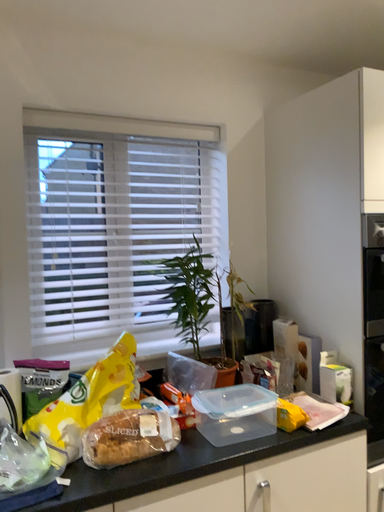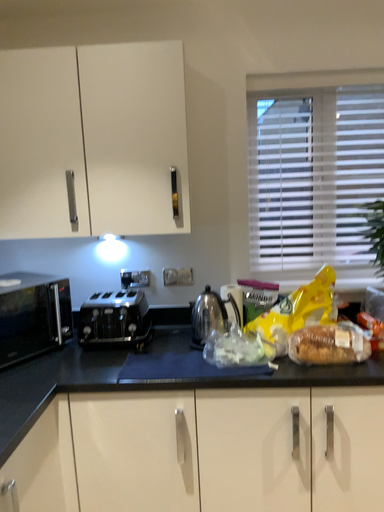
Question: How did the camera likely rotate when shooting the video?

Choices:
 (A) rotated upward
 (B) rotated downward

Answer: (B)